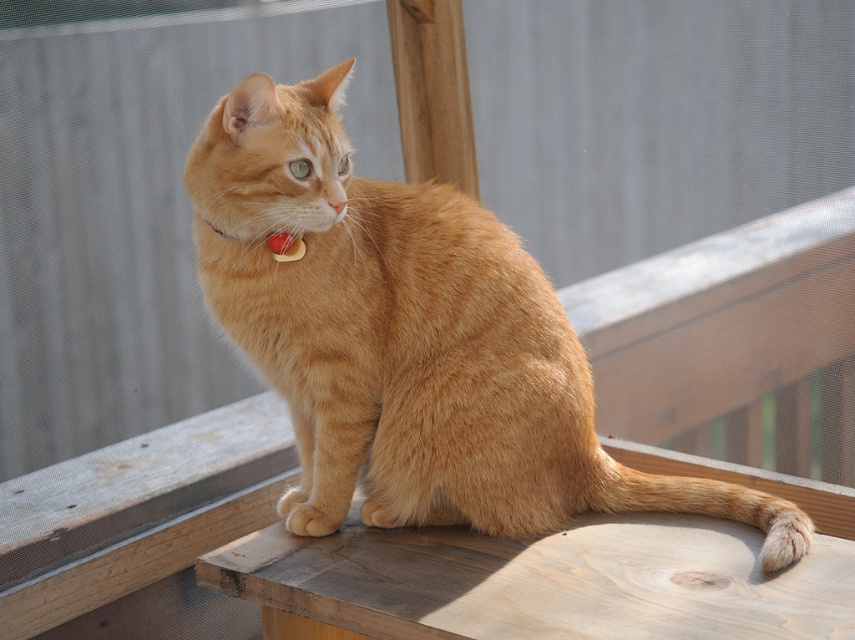
Is orange fur cat at center smaller than red plastic collar at center?

Actually, orange fur cat at center might be larger than red plastic collar at center.

Is point (256, 323) in front of point (282, 253)?

No.

Who is more distant from viewer, [467,227] or [289,244]?

Positioned behind is point [467,227].

Where is `orange fur cat at center`? orange fur cat at center is located at coordinates (411, 340).